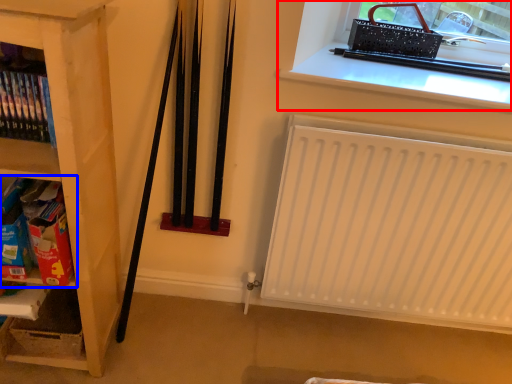
Question: Which point is closer to the camera, window (highlighted by a red box) or shelf (highlighted by a blue box)?

Choices:
 (A) window
 (B) shelf

Answer: (B)